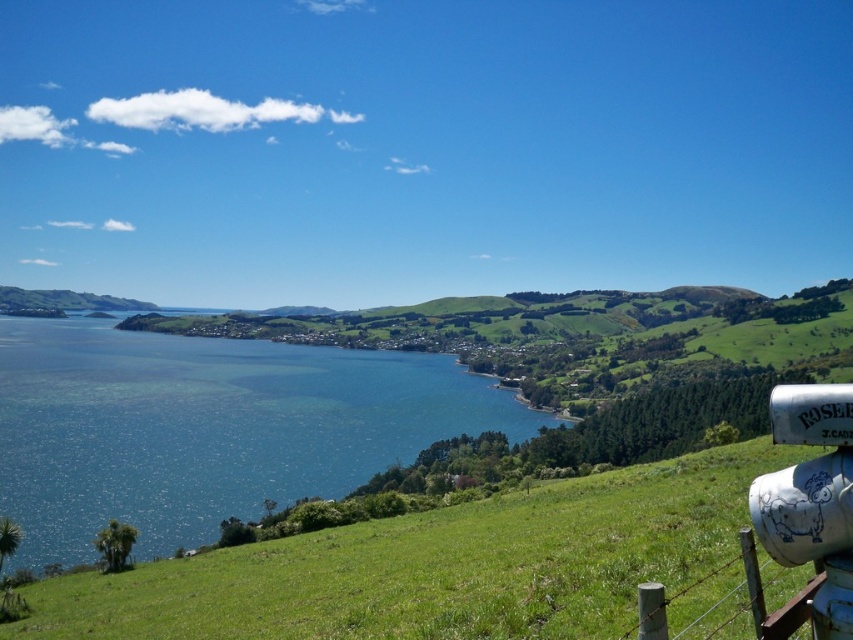
You are a hiker standing on the green grassy hillside at lower right and want to reach the blue water at center. Based on the distance provided, can you estimate how long it would take you to walk there at a moderate pace?

The distance between the green grassy hillside at lower right and the blue water at center is 422.85 feet. At a moderate walking pace of about 3 feet per second, it would take approximately 141 seconds, which is roughly 2 minutes and 21 seconds.

You are standing on the green grassy hillside at lower right and want to get to the blue water at center. Which direction should you walk to reach the water?

Since the green grassy hillside at lower right is shorter than the blue water at center, you should walk towards the center of the image where the blue water is located to reach it.